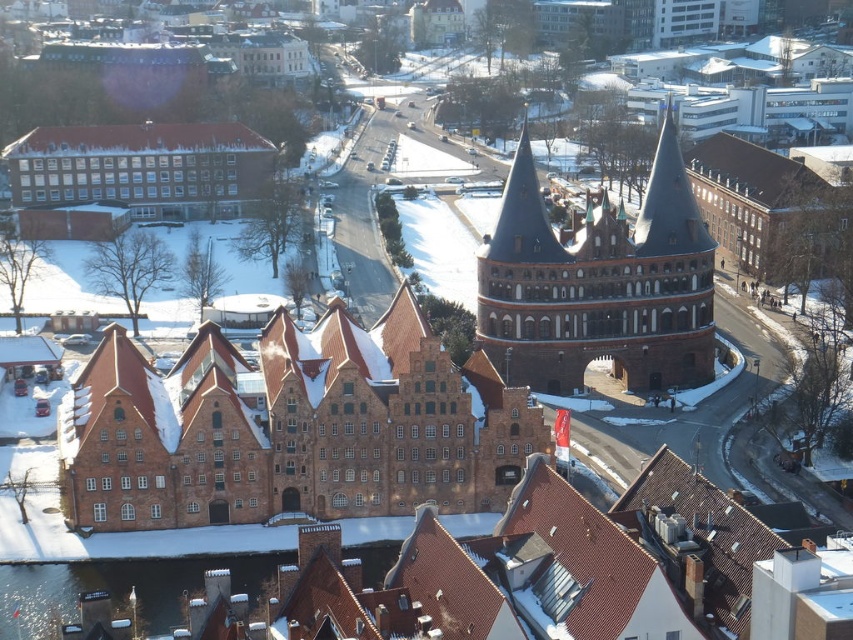
Can you confirm if brown brick building at center is thinner than brown stone tower at center?

No, brown brick building at center is not thinner than brown stone tower at center.

Which is behind, point (70, 483) or point (543, 330)?

The point (543, 330) is more distant.

Identify the location of brown brick building at center. The height and width of the screenshot is (640, 853). (291, 426).

Where is `brown brick building at center`? brown brick building at center is located at coordinates (291, 426).